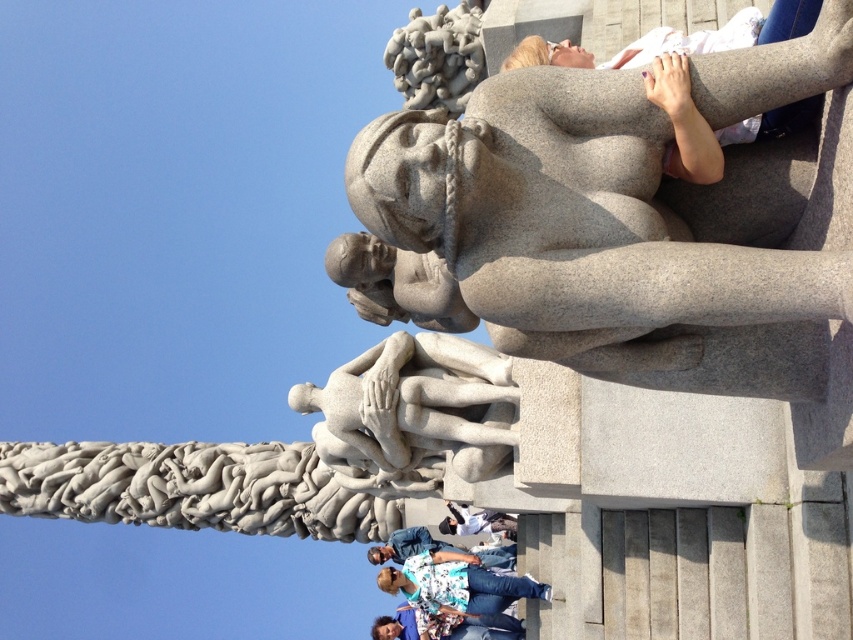
Question: Is gray stone statue at upper center bigger than white stone sculpture at center?

Choices:
 (A) no
 (B) yes

Answer: (B)

Question: Can you confirm if gray stone statue at upper center is thinner than white cotton shirt at upper center?

Choices:
 (A) yes
 (B) no

Answer: (B)

Question: Can you confirm if white stone sculpture at center is positioned to the right of white cotton shirt at upper center?

Choices:
 (A) yes
 (B) no

Answer: (B)

Question: Which is farther from the white stone sculpture at center?

Choices:
 (A) white cotton shirt at lower center
 (B) white cotton shirt at upper center

Answer: (B)

Question: Which object is positioned farthest from the white cotton shirt at lower center?

Choices:
 (A) white stone sculpture at center
 (B) gray stone statue at upper center

Answer: (B)

Question: Which point is closer to the camera?

Choices:
 (A) (492, 520)
 (B) (485, 593)
 (C) (508, 378)

Answer: (C)